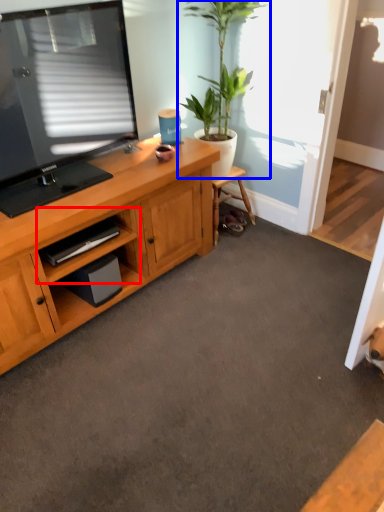
Question: Which point is closer to the camera, cabinet (highlighted by a red box) or houseplant (highlighted by a blue box)?

Choices:
 (A) cabinet
 (B) houseplant

Answer: (A)